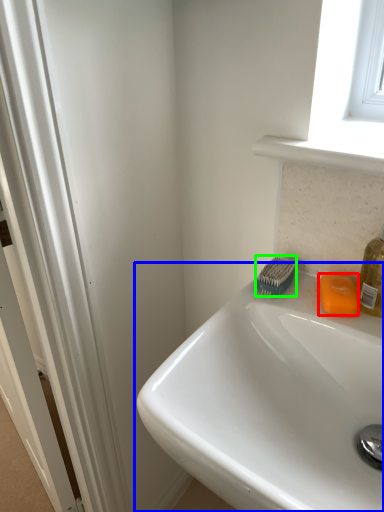
Question: Which is nearer to the soap (highlighted by a red box)? sink (highlighted by a blue box) or brush (highlighted by a green box).

Choices:
 (A) sink
 (B) brush

Answer: (B)